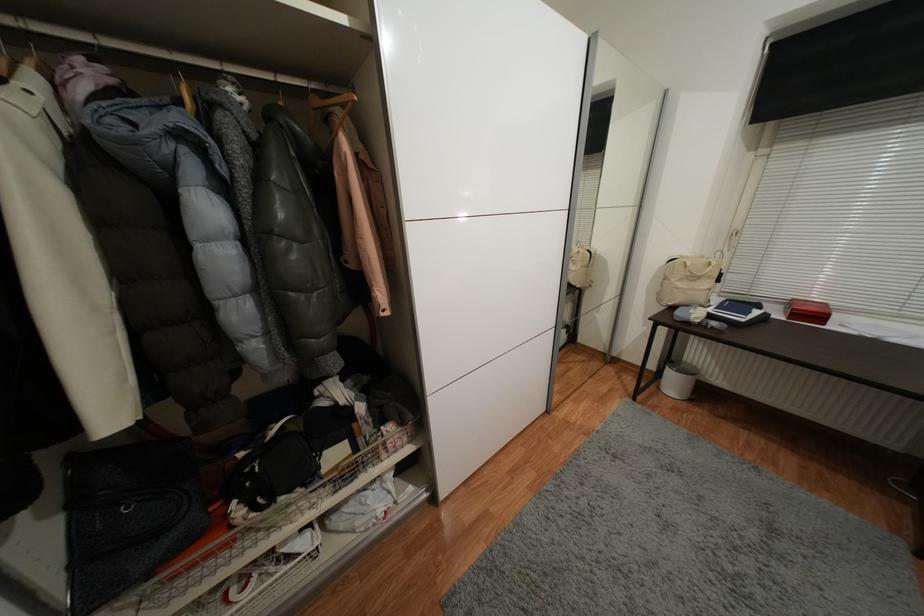
Which object does [261,531] point to?

It corresponds to the wire basket in the image.